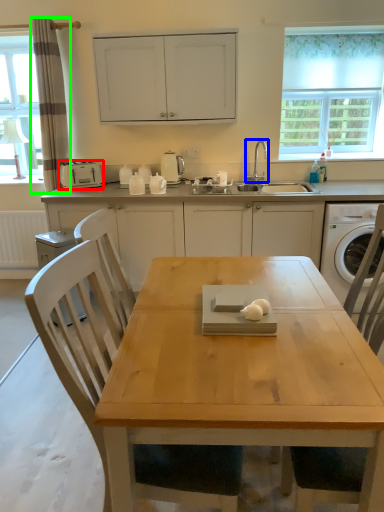
Question: Which object is the farthest from kitchen appliance (highlighted by a red box)? Choose among these: tap (highlighted by a blue box) or curtain (highlighted by a green box).

Choices:
 (A) tap
 (B) curtain

Answer: (A)